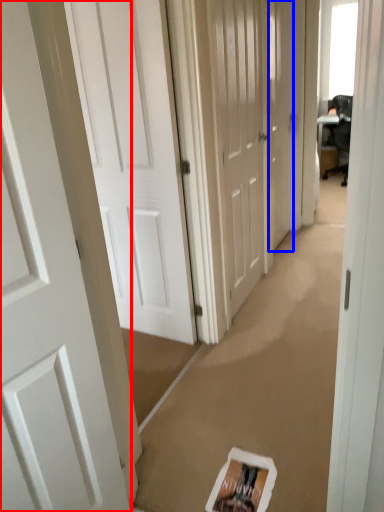
Question: Which point is further to the camera, door (highlighted by a red box) or door (highlighted by a blue box)?

Choices:
 (A) door
 (B) door

Answer: (B)